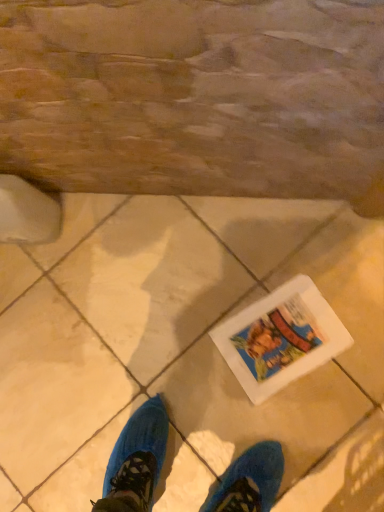
The height and width of the screenshot is (512, 384). Find the location of `vacant space underneath white matte comic book at lower center (from a real-world perspective)`. vacant space underneath white matte comic book at lower center (from a real-world perspective) is located at coordinates (286, 336).